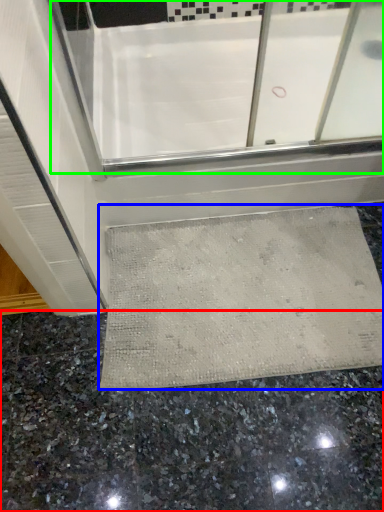
Question: Estimate the real-world distances between objects in this image. Which object is closer to granite (highlighted by a red box), bath mat (highlighted by a blue box) or bath (highlighted by a green box)?

Choices:
 (A) bath mat
 (B) bath

Answer: (A)